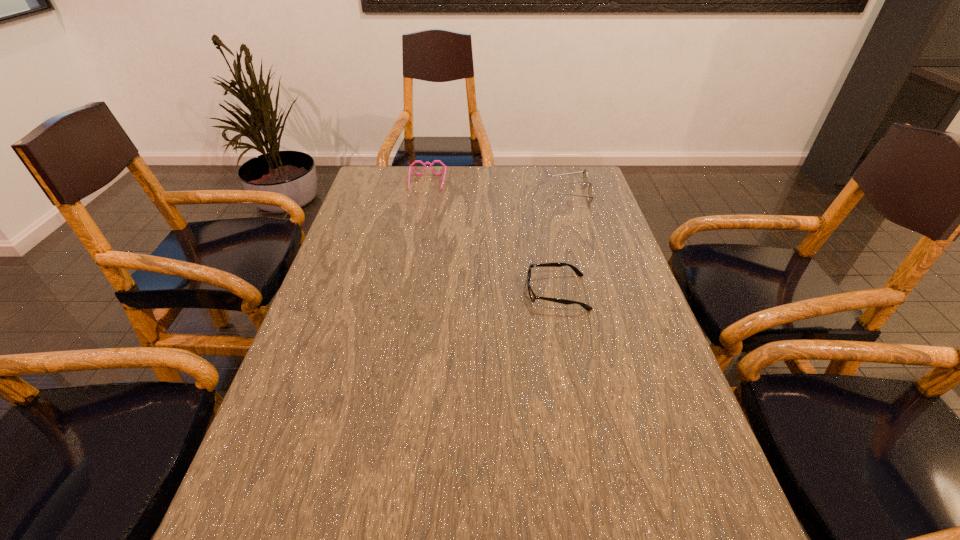
Image resolution: width=960 pixels, height=540 pixels. In order to click on vacant area between the shortest object and the tallest object in this screenshot , I will do `click(564, 244)`.

At what (x,y) coordinates should I click in order to perform the action: click on vacant area that lies between the tallest object and the shortest spectacles. Please return your answer as a coordinate pair (x, y). Image resolution: width=960 pixels, height=540 pixels. Looking at the image, I should click on (564, 244).

The image size is (960, 540). Identify the location of vacant point located between the tallest spectacles and the nearest spectacles. (564, 244).

What are the coordinates of `empty location between the second shortest object and the shortest object` in the screenshot? It's located at (492, 238).

This screenshot has height=540, width=960. Find the location of `the second closest object to the tallest object`. the second closest object to the tallest object is located at coordinates (410, 167).

Identify which object is the second nearest to the tallest spectacles. Please provide its 2D coordinates. Your answer should be formatted as a tuple, i.e. [(x, y)], where the tuple contains the x and y coordinates of a point satisfying the conditions above.

[(410, 167)]

Locate which spectacles ranks second in proximity to the shortest object. Please provide its 2D coordinates. Your answer should be formatted as a tuple, i.e. [(x, y)], where the tuple contains the x and y coordinates of a point satisfying the conditions above.

[(410, 167)]

Locate an element on the screen. Image resolution: width=960 pixels, height=540 pixels. spectacles that is the second closest to the leftmost spectacles is located at coordinates (533, 297).